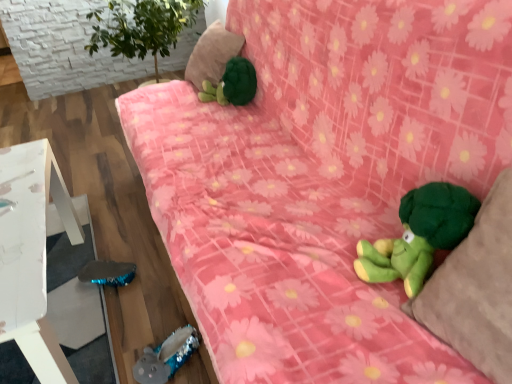
Question: Does shiny blue plush toy at lower left, the first toy when ordered from left to right, have a larger size compared to green plush turtle at upper center, which appears as the 2th toy when viewed from the right?

Choices:
 (A) no
 (B) yes

Answer: (A)

Question: Is shiny blue plush toy at lower left, which is the 1th toy from bottom to top, facing away from green plush turtle at upper center, the 1th toy when ordered from top to bottom?

Choices:
 (A) no
 (B) yes

Answer: (A)

Question: From the image's perspective, is shiny blue plush toy at lower left, which is the third toy in right-to-left order, below green plush turtle at upper center, the third toy ordered from the bottom?

Choices:
 (A) no
 (B) yes

Answer: (B)

Question: Would you say green plush turtle at upper center, the third toy positioned from the front, is part of shiny blue plush toy at lower left, the first toy when ordered from left to right,'s contents?

Choices:
 (A) no
 (B) yes

Answer: (A)

Question: Is the depth of shiny blue plush toy at lower left, which appears as the 2th toy when viewed from the back, less than that of green plush turtle at upper center, which appears as the 2th toy when viewed from the right?

Choices:
 (A) yes
 (B) no

Answer: (A)

Question: Is green plush turtle at upper center, the 1th toy when ordered from back to front, taller or shorter than green plush at upper center, which ranks as the 2th pillow in right-to-left order?

Choices:
 (A) tall
 (B) short

Answer: (B)

Question: Is green plush turtle at upper center, the third toy positioned from the front, situated inside green plush at upper center, acting as the second pillow starting from the front, or outside?

Choices:
 (A) inside
 (B) outside

Answer: (B)

Question: Considering the positions of green plush turtle at upper center, the third toy ordered from the bottom, and green plush at upper center, the first pillow when ordered from back to front, in the image, is green plush turtle at upper center, the third toy ordered from the bottom, wider or thinner than green plush at upper center, the first pillow when ordered from back to front,?

Choices:
 (A) thin
 (B) wide

Answer: (A)

Question: Is point (256, 81) closer or farther from the camera than point (225, 61)?

Choices:
 (A) closer
 (B) farther

Answer: (A)

Question: From the image's perspective, is green plush at upper center, placed as the 1th pillow when sorted from left to right, above or below green plush pillow at right, which ranks as the first pillow in bottom-to-top order?

Choices:
 (A) above
 (B) below

Answer: (A)

Question: Is point pos(202,51) closer or farther from the camera than point pos(437,327)?

Choices:
 (A) closer
 (B) farther

Answer: (B)

Question: From a real-world perspective, is green plush at upper center, the 2th pillow positioned from the bottom, physically located above or below green plush pillow at right, the first pillow positioned from the right?

Choices:
 (A) below
 (B) above

Answer: (A)

Question: Is green plush at upper center, which is the first pillow in top-to-bottom order, in front of or behind green plush pillow at right, acting as the second pillow starting from the top, in the image?

Choices:
 (A) behind
 (B) front

Answer: (A)

Question: From a real-world perspective, is green plush at upper center, which ranks as the 2th pillow in right-to-left order, above or below shiny blue plush toy at lower left, which appears as the 2th toy when viewed from the back?

Choices:
 (A) above
 (B) below

Answer: (A)

Question: Visually, is green plush at upper center, placed as the 1th pillow when sorted from left to right, positioned to the left or to the right of shiny blue plush toy at lower left, which is the 1th toy from bottom to top?

Choices:
 (A) right
 (B) left

Answer: (A)